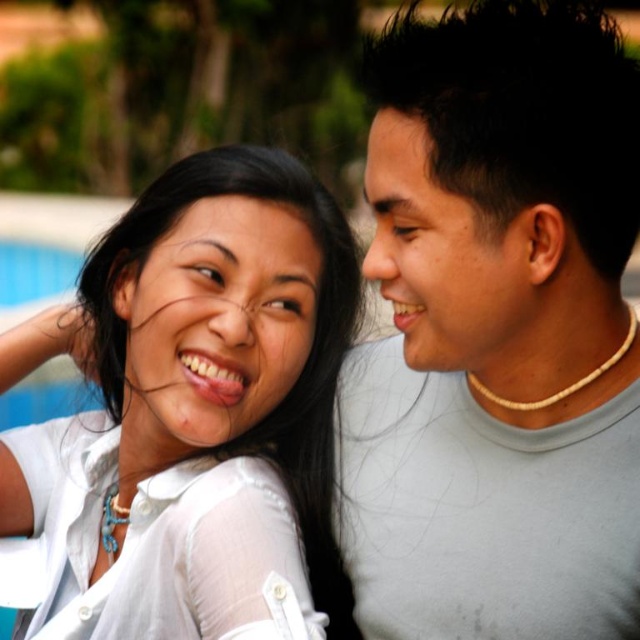
Question: Does gray matte shirt at center appear on the right side of white matte shirt at upper left?

Choices:
 (A) yes
 (B) no

Answer: (A)

Question: Which point appears farthest from the camera in this image?

Choices:
 (A) click(x=529, y=428)
 (B) click(x=19, y=442)

Answer: (B)

Question: Can you confirm if gray matte shirt at center is positioned to the right of white matte shirt at upper left?

Choices:
 (A) no
 (B) yes

Answer: (B)

Question: Where is gray matte shirt at center located in relation to white matte shirt at upper left in the image?

Choices:
 (A) above
 (B) below

Answer: (A)